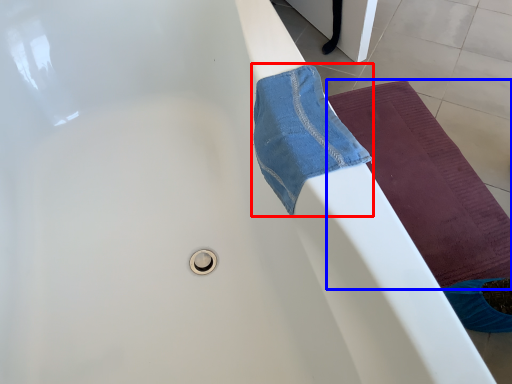
Question: Which point is further to the camera, beach towel (highlighted by a red box) or yoga mat (highlighted by a blue box)?

Choices:
 (A) beach towel
 (B) yoga mat

Answer: (B)